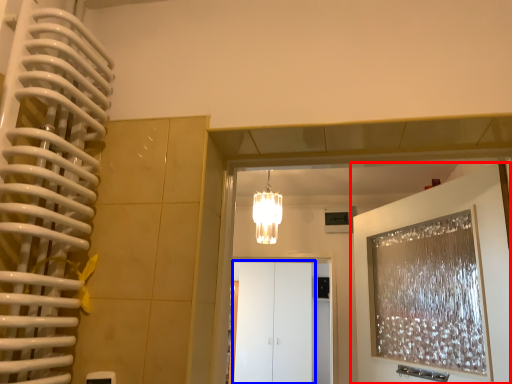
Question: Which point is closer to the camera, door (highlighted by a red box) or glass door (highlighted by a blue box)?

Choices:
 (A) door
 (B) glass door

Answer: (A)